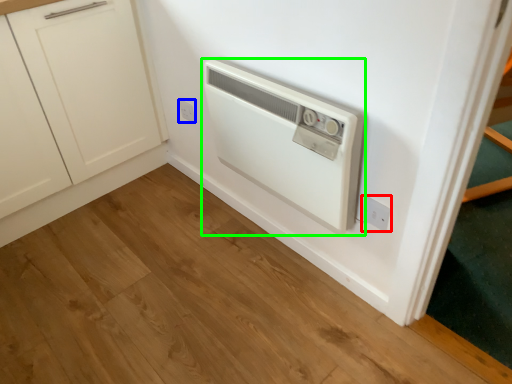
Question: Which object is the closest to the electric outlet (highlighted by a red box)? Choose among these: electric outlet (highlighted by a blue box) or home appliance (highlighted by a green box).

Choices:
 (A) electric outlet
 (B) home appliance

Answer: (B)